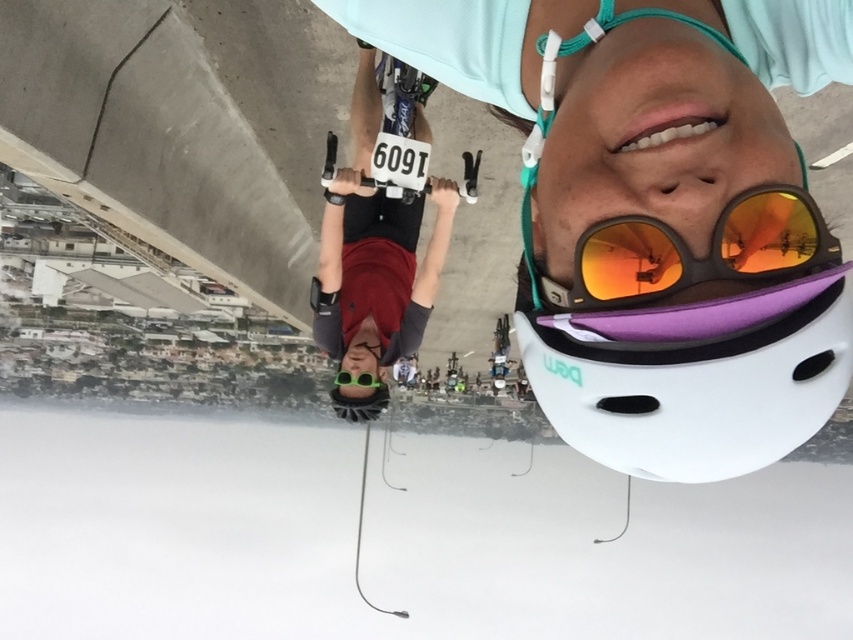
Does matte black helmet at center come in front of matte orange lens goggles at upper center?

That is False.

In the scene shown: Which of these two, matte black helmet at center or matte orange lens goggles at upper center, stands shorter?

matte orange lens goggles at upper center is shorter.

Does point (320, 259) lie behind point (575, 301)?

Yes, point (320, 259) is farther from viewer.

Find the location of a particular element. matte black helmet at center is located at coordinates (373, 260).

Looking at this image, does matte black helmet at upper center have a smaller size compared to matte black helmet at center?

→ Correct, matte black helmet at upper center occupies less space than matte black helmet at center.

Is point (822, 253) in front of point (364, 264)?

Yes.

Where is `matte black helmet at upper center`? Image resolution: width=853 pixels, height=640 pixels. matte black helmet at upper center is located at coordinates (654, 209).

Locate an element on the screen. This screenshot has height=640, width=853. matte black helmet at upper center is located at coordinates (654, 209).

Can you confirm if matte orange lens goggles at upper center is positioned below green matte/glossy goggles at center?

No.

Does point (730, 236) come farther from viewer compared to point (364, 381)?

No, (730, 236) is in front of (364, 381).

Locate an element on the screen. matte orange lens goggles at upper center is located at coordinates (691, 253).